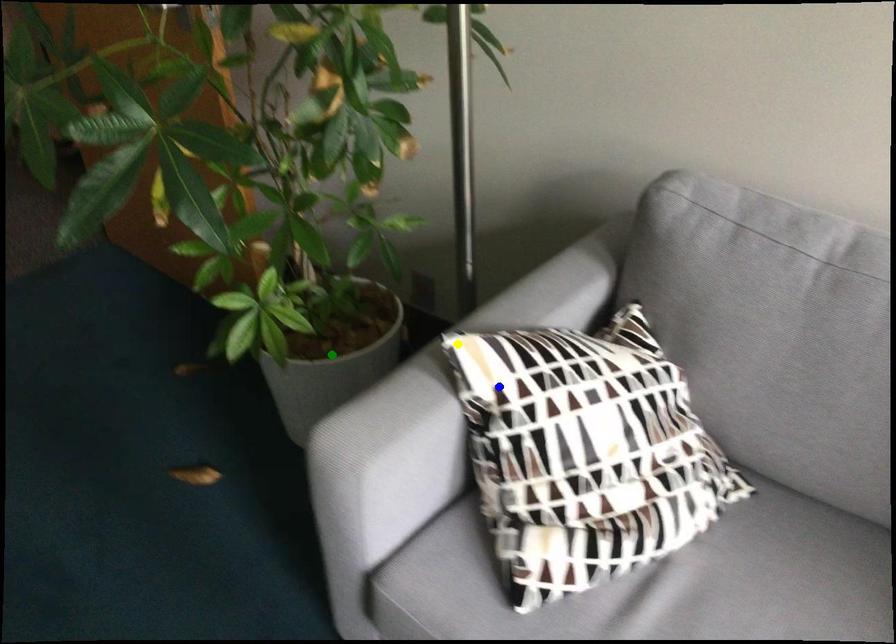
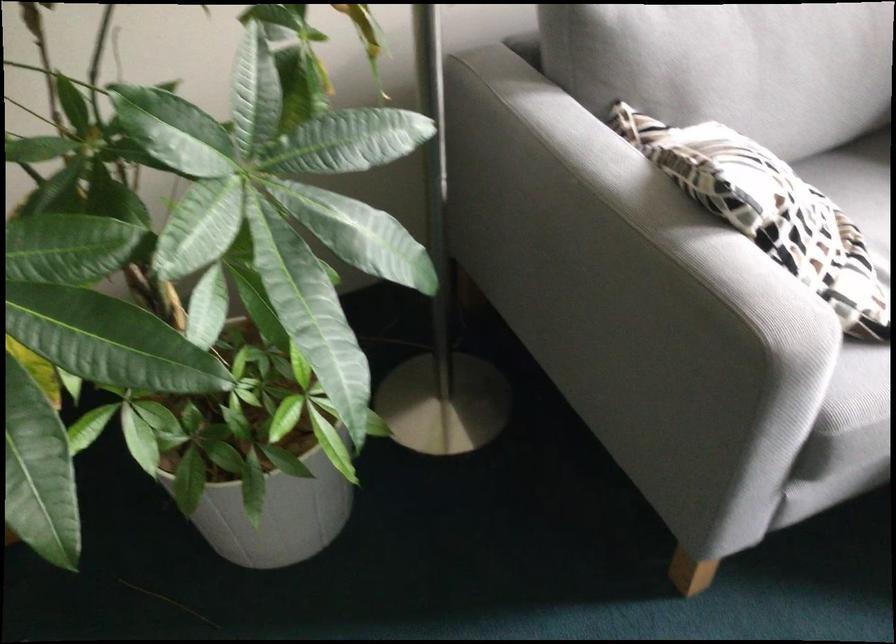
I am providing you with two images of the same scene from different viewpoints. Three points are marked in image1. Which point corresponds to a part or object that is occluded in image2?In image1, three points are marked. Which of them correspond to a part or object that is occluded in image2?Among the three points shown in image1, which one corresponds to a part or object that is no longer visible due to occlusion in image2?

green point